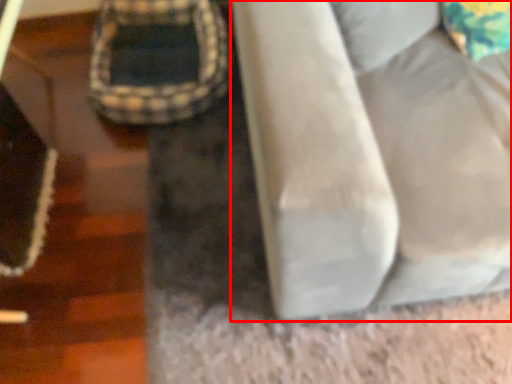
Question: From the image, what is the correct spatial relationship of furniture (annotated by the red box) in relation to bean bag chair?

Choices:
 (A) right
 (B) left

Answer: (A)